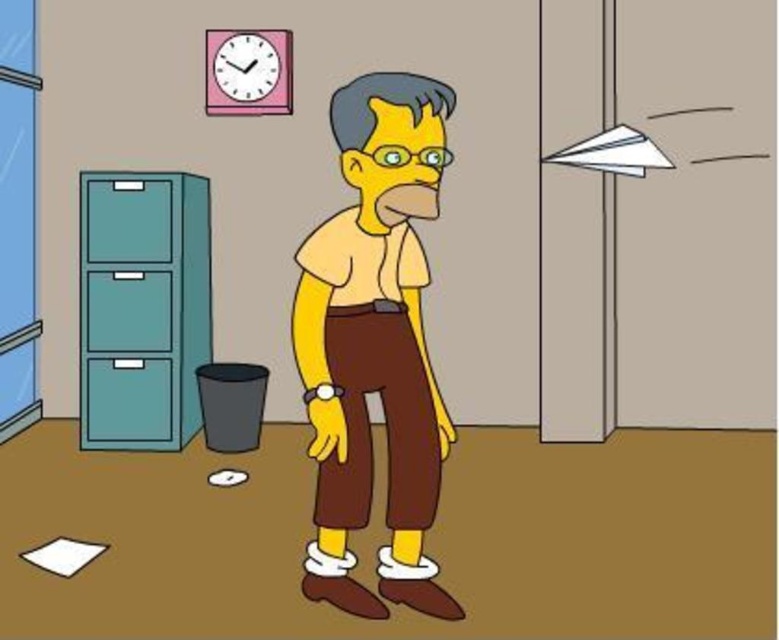
Does teal matte/file cabinet at left have a larger size compared to pink matte clock at upper center?

Correct, teal matte/file cabinet at left is larger in size than pink matte clock at upper center.

Is teal matte/file cabinet at left thinner than pink matte clock at upper center?

In fact, teal matte/file cabinet at left might be wider than pink matte clock at upper center.

Between point (150, 353) and point (210, 58), which one is positioned in front?

Point (150, 353) is more forward.

The height and width of the screenshot is (640, 779). Identify the location of teal matte/file cabinet at left. (x=143, y=307).

Does matte brown pants at center appear under teal matte/file cabinet at left?

Yes, matte brown pants at center is below teal matte/file cabinet at left.

Who is taller, matte brown pants at center or teal matte/file cabinet at left?

With more height is matte brown pants at center.

Does point (374, 202) lie in front of point (90, 438)?

Yes, it is.

The image size is (779, 640). In order to click on matte brown pants at center in this screenshot , I will do `click(374, 342)`.

Between matte brown pants at center and pink matte clock at upper center, which one is positioned higher?

pink matte clock at upper center is above.

From the picture: Does matte brown pants at center have a greater width compared to pink matte clock at upper center?

Correct, the width of matte brown pants at center exceeds that of pink matte clock at upper center.

Where is `matte brown pants at center`? matte brown pants at center is located at coordinates (374, 342).